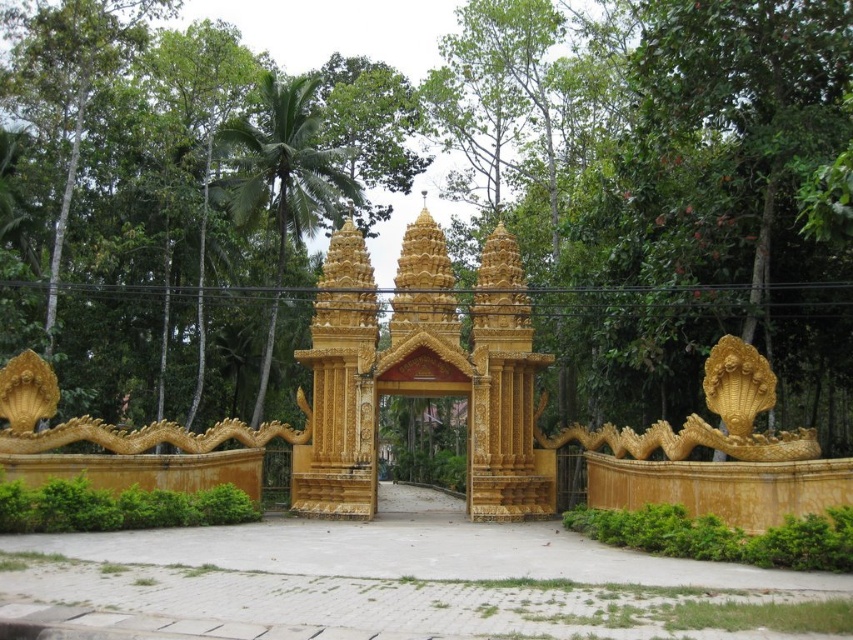
Does point (483, 288) come in front of point (283, 182)?

Yes, point (483, 288) is in front of point (283, 182).

Between golden polished gate at center and green leafy tree at upper left, which one has less height?

golden polished gate at center is shorter.

Is point (440, 340) closer to camera compared to point (287, 180)?

Yes, point (440, 340) is in front of point (287, 180).

Locate an element on the screen. golden polished gate at center is located at coordinates (422, 372).

Which is below, green leafy tree at center or gold ornate gate at center?

Positioned lower is gold ornate gate at center.

Which of these two, green leafy tree at center or gold ornate gate at center, stands taller?

Standing taller between the two is green leafy tree at center.

What do you see at coordinates (440, 195) in the screenshot?
I see `green leafy tree at center` at bounding box center [440, 195].

At what (x,y) coordinates should I click in order to perform the action: click on green leafy tree at center. Please return your answer as a coordinate pair (x, y). The image size is (853, 640). Looking at the image, I should click on (440, 195).

Is green leafy tree at center wider than green leafy tree at upper left?

Yes, green leafy tree at center is wider than green leafy tree at upper left.

Measure the distance between point (795,60) and camera.

A distance of 83.21 meters exists between point (795,60) and camera.

Does point (693, 362) lie in front of point (310, 118)?

Yes, it is in front of point (310, 118).

This screenshot has height=640, width=853. Find the location of `green leafy tree at center`. green leafy tree at center is located at coordinates (440, 195).